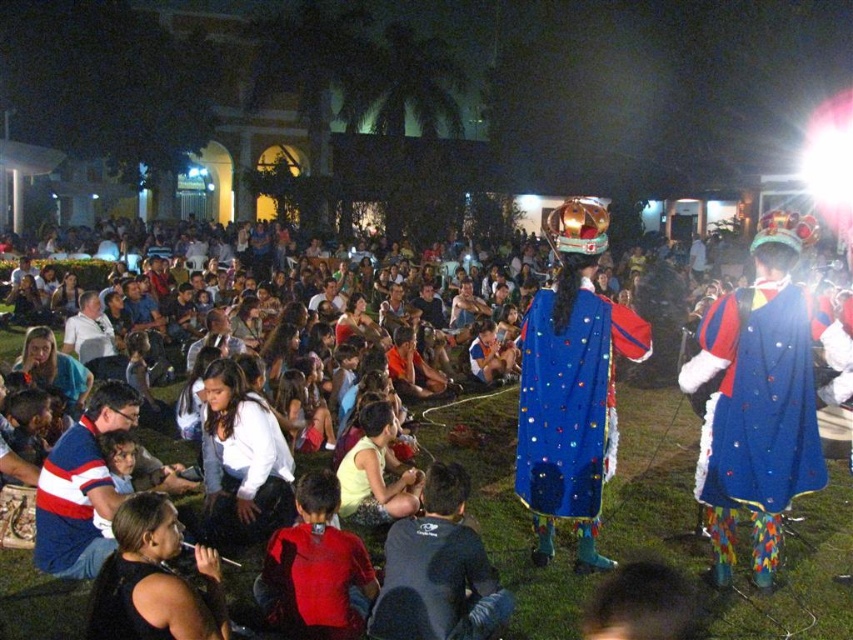
Is point (506, 499) closer to viewer compared to point (386, 504)?

No, (506, 499) is behind (386, 504).

Between blue sequined costume at center and yellow fabric dress at center, which one has more height?

blue sequined costume at center

Find the location of a particular element. blue sequined costume at center is located at coordinates (577, 504).

Identify the location of blue sequined costume at center. The height and width of the screenshot is (640, 853). (577, 504).

Measure the distance from black fabric shirt at lower left to striped cotton shirt at lower left.

black fabric shirt at lower left and striped cotton shirt at lower left are 1.28 meters apart.

Is black fabric shirt at lower left further to camera compared to striped cotton shirt at lower left?

No, black fabric shirt at lower left is in front of striped cotton shirt at lower left.

What do you see at coordinates (154, 580) in the screenshot?
I see `black fabric shirt at lower left` at bounding box center [154, 580].

Image resolution: width=853 pixels, height=640 pixels. What are the coordinates of `black fabric shirt at lower left` in the screenshot? It's located at (154, 580).

Who is more distant from viewer, [738,451] or [248,465]?

The point [248,465] is more distant.

Between shiny blue cape at center and white matte shirt at center, which one appears on the right side from the viewer's perspective?

Positioned to the right is shiny blue cape at center.

Between point (822, 328) and point (209, 536), which one is positioned in front?

Point (209, 536) is more forward.

The height and width of the screenshot is (640, 853). Identify the location of shiny blue cape at center. (761, 397).